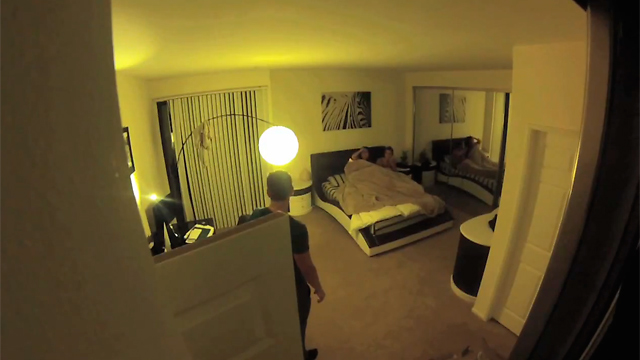
Locate an element on the screen. mirror is located at coordinates (436, 125), (482, 128).